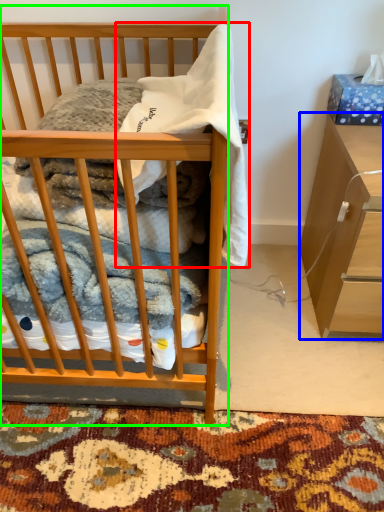
Question: Considering the real-world distances, which object is farthest from baby clothe (highlighted by a red box)? cabinetry (highlighted by a blue box) or desk (highlighted by a green box)?

Choices:
 (A) cabinetry
 (B) desk

Answer: (A)